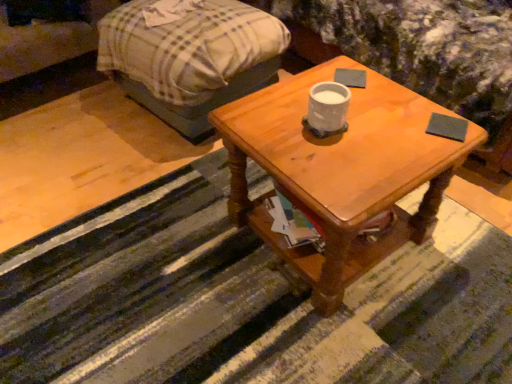
In order to click on free space in front of dark gray matte pad at upper center, marked as the second pad in a right-to-left arrangement in this screenshot , I will do `click(375, 109)`.